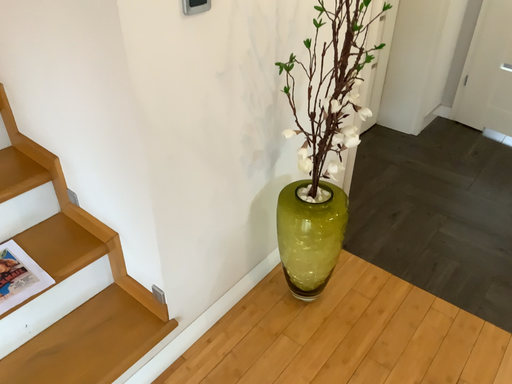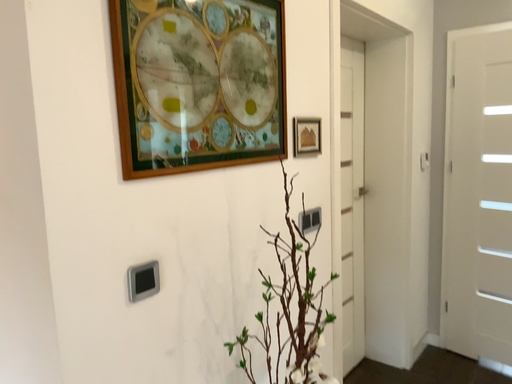
Question: How did the camera likely rotate when shooting the video?

Choices:
 (A) rotated downward
 (B) rotated upward

Answer: (B)